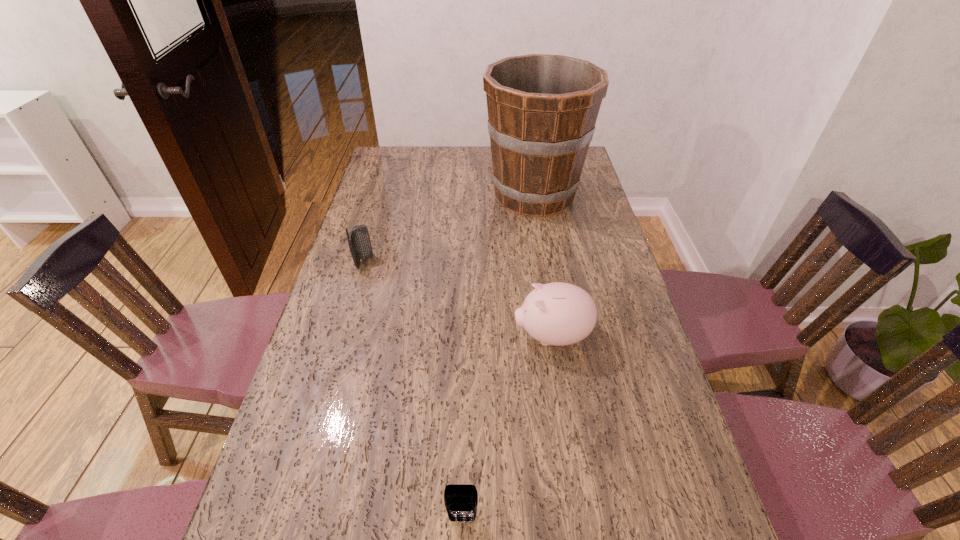
Where is `unoccupied area between the bucket and the second object from left to right`? unoccupied area between the bucket and the second object from left to right is located at coordinates (498, 357).

Find the location of `object that can be found as the second closest to the bucket`. object that can be found as the second closest to the bucket is located at coordinates (559, 314).

Identify the location of object that stands as the third closest to the third farthest object. (359, 242).